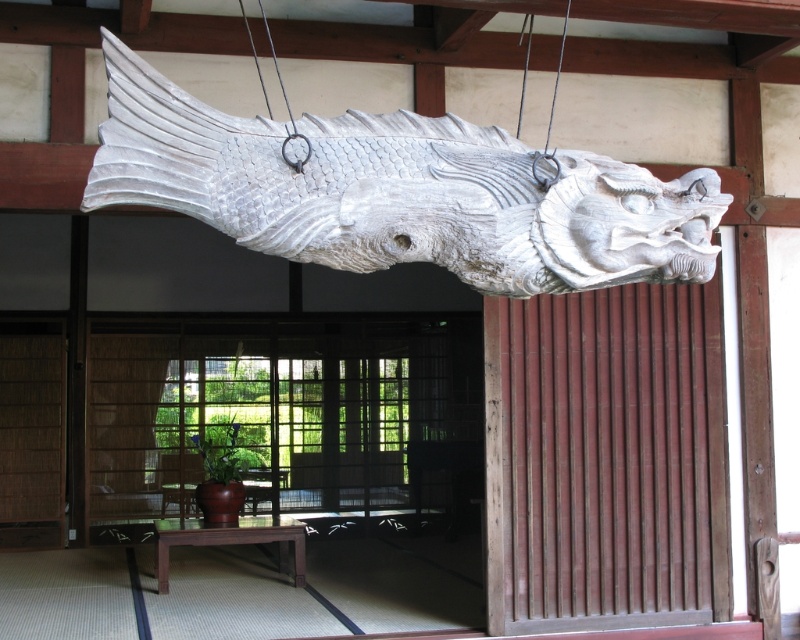
Question: Which point is farther from the camera taking this photo?

Choices:
 (A) (378, 352)
 (B) (293, 244)

Answer: (A)

Question: Which object is closer to the camera taking this photo?

Choices:
 (A) white wood fish at center
 (B) wooden sliding door at center

Answer: (A)

Question: Can you confirm if wooden sliding door at center is positioned to the left of white wood fish at center?

Choices:
 (A) yes
 (B) no

Answer: (A)

Question: Which object is closer to the camera taking this photo?

Choices:
 (A) white wood fish at center
 (B) wooden sliding door at center

Answer: (A)

Question: Is wooden sliding door at center wider than white wood fish at center?

Choices:
 (A) no
 (B) yes

Answer: (A)

Question: Does wooden sliding door at center appear over white wood fish at center?

Choices:
 (A) no
 (B) yes

Answer: (A)